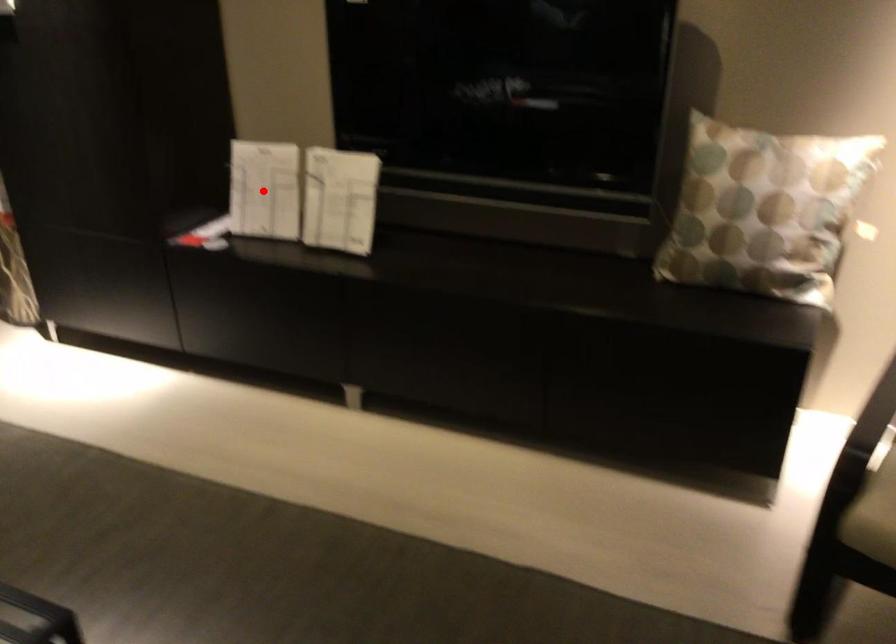
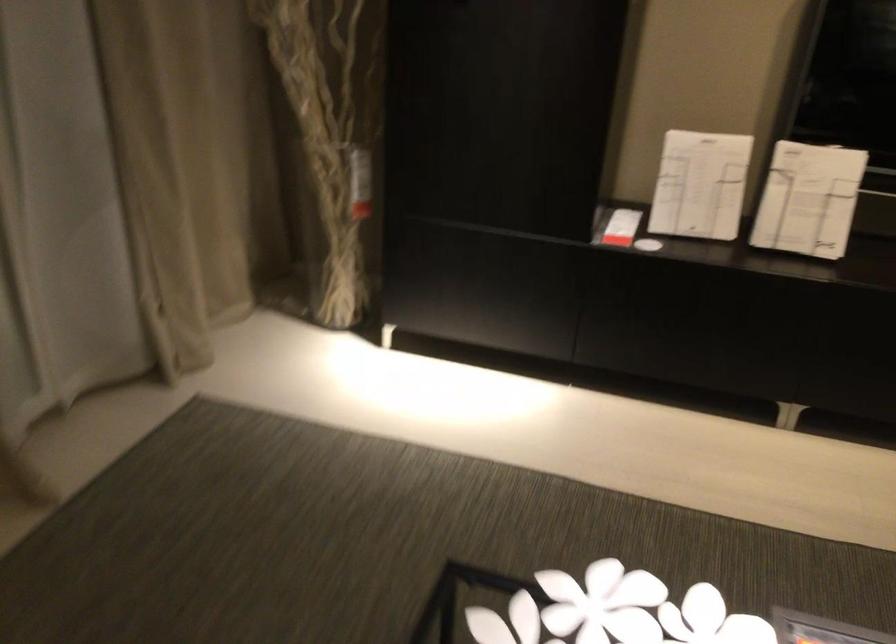
Question: I am providing you with two images of the same scene from different viewpoints. In image1, a red point is highlighted. Considering the same 3D point in image2, which of the following is correct?

Choices:
 (A) It is closer
 (B) It is farther

Answer: (A)